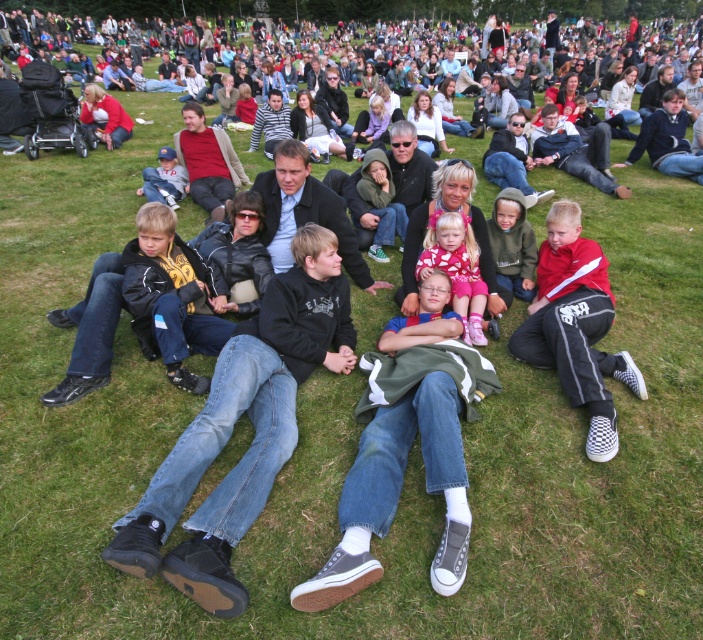
Question: Among these objects, which one is nearest to the camera?

Choices:
 (A) blue denim jeans at center
 (B) matte blue cap at center

Answer: (A)

Question: Which of the following is the closest to the observer?

Choices:
 (A) blue denim jeans at center
 (B) matte blue cap at center

Answer: (A)

Question: Is blue denim jeans at center smaller than matte blue cap at center?

Choices:
 (A) yes
 (B) no

Answer: (A)

Question: Which point is farther from the camera taking this photo?

Choices:
 (A) (437, 284)
 (B) (160, 182)

Answer: (B)

Question: In this image, where is pink satin dress at center located relative to matte blue cap at center?

Choices:
 (A) left
 (B) right

Answer: (B)

Question: Does blue denim jeans at center appear under matte blue cap at center?

Choices:
 (A) yes
 (B) no

Answer: (A)